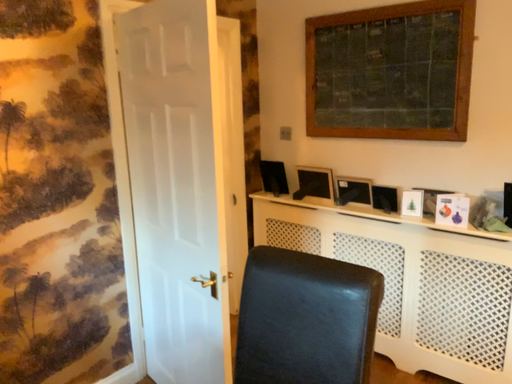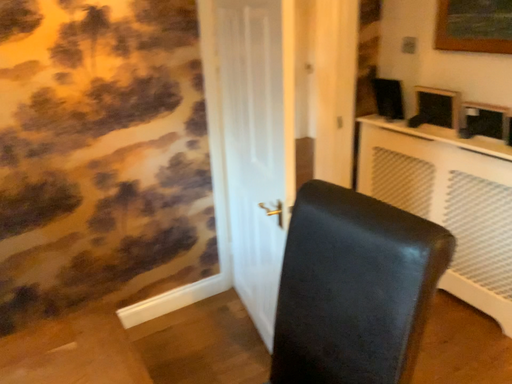
Question: How did the camera likely rotate when shooting the video?

Choices:
 (A) rotated right
 (B) rotated left

Answer: (B)